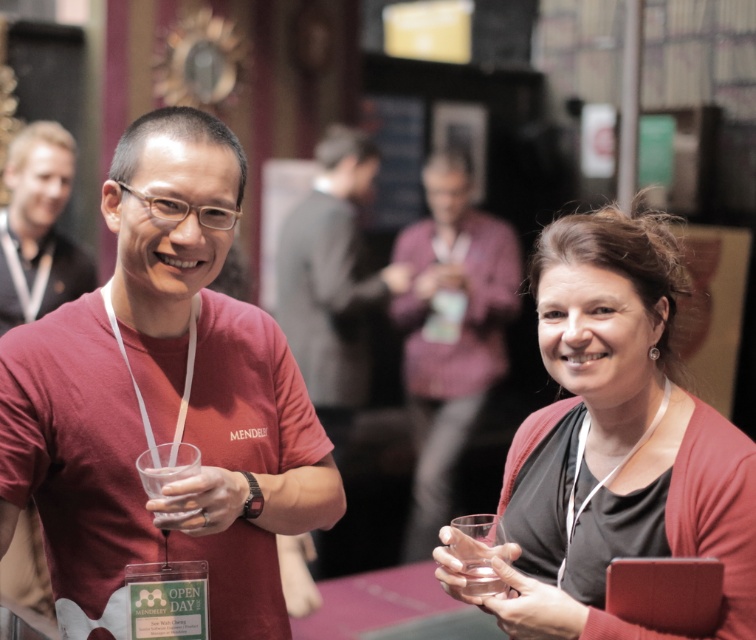
Question: Does matte red t-shirt at left have a larger size compared to clear glass at right?

Choices:
 (A) yes
 (B) no

Answer: (A)

Question: Based on their relative distances, which object is farther from the matte red shirt at center?

Choices:
 (A) maroon t-shirt at left
 (B) transparent plastic cup at lower center

Answer: (B)

Question: Can you confirm if clear glass at right is positioned below translucent plastic cup at center?

Choices:
 (A) yes
 (B) no

Answer: (A)

Question: Estimate the real-world distances between objects in this image. Which object is farther from the matte black cardigan at right?

Choices:
 (A) matte red shirt at center
 (B) clear glass at right
 (C) translucent plastic cup at center

Answer: (A)

Question: Does matte red t-shirt at left have a lesser width compared to translucent plastic cup at center?

Choices:
 (A) no
 (B) yes

Answer: (A)

Question: Which of the following is the farthest from the observer?

Choices:
 (A) transparent plastic cup at lower center
 (B) matte red t-shirt at left

Answer: (A)